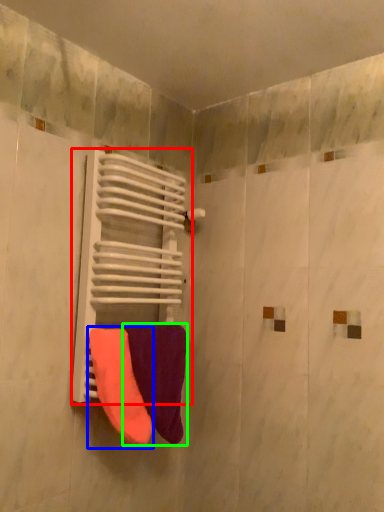
Question: Which is farther away from radiator (highlighted by a red box)? towel (highlighted by a blue box) or towel (highlighted by a green box)?

Choices:
 (A) towel
 (B) towel

Answer: (A)